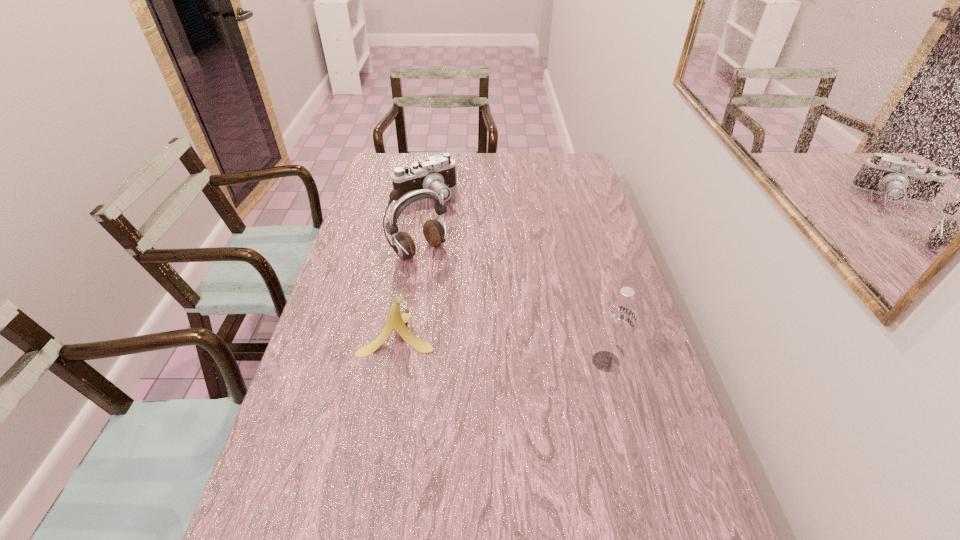
You are a GUI agent. You are given a task and a screenshot of the screen. Output one action in this format:
    pyautogui.click(x=<x>, y=<y>)
    Task: Click on the vacant region between the rightmost object and the banana
    This screenshot has height=540, width=960.
    Given the screenshot: What is the action you would take?
    pyautogui.click(x=502, y=347)

Identify the location of vacant space that's between the camera and the earphone. This screenshot has width=960, height=540. (423, 223).

Locate an element on the screen. This screenshot has width=960, height=540. object that stands as the second closest to the banana is located at coordinates pyautogui.click(x=618, y=321).

Where is `the third closest object relative to the banana`? the third closest object relative to the banana is located at coordinates (437, 173).

Locate an element on the screen. This screenshot has width=960, height=540. free space that satisfies the following two spatial constraints: 1. on the front side of the banana; 2. on the front label of the rightmost object is located at coordinates (393, 361).